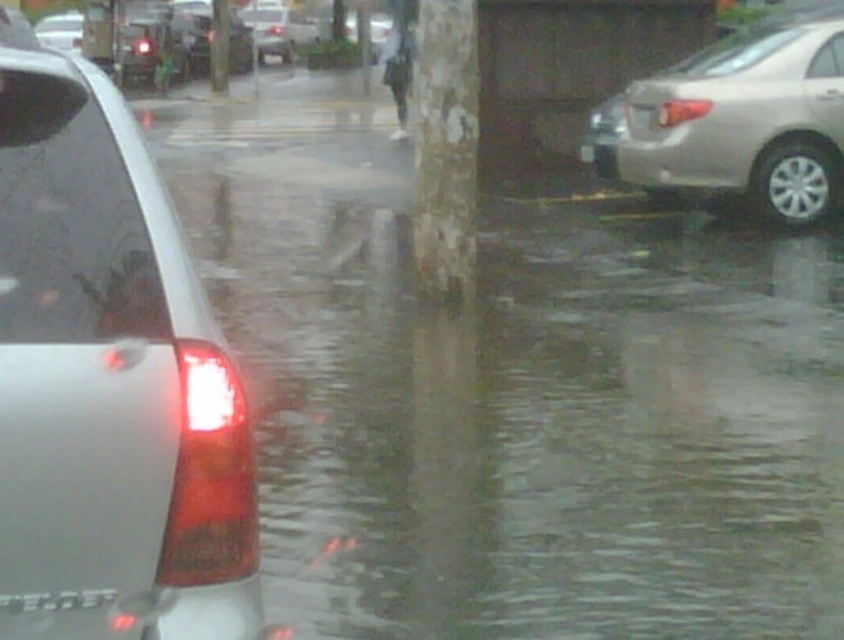
You are standing on the wet street and see the point at coordinates (x=745, y=122). What object is located at that point?

The point at coordinates (x=745, y=122) corresponds to the satin beige sedan at right.

You are a parking attendant trying to fit a new car into the space between the satin beige sedan at right and the matte black car at left. The new car is 1.8 meters wide. Can the new car fit in the space between them?

The satin beige sedan at right is wider than the matte black car at left, so the space between them may vary. However, since the exact width of the space isn not provided, we cannot determine if the new car will fit. Please measure the space physically.

Consider the image. You are standing at the point with coordinates point (109, 381). Looking around, you see the satin silver car at left. Is the car closer to you or farther away compared to the tree trunk in the midground?

The point (109, 381) indicates the satin silver car at left, so the car is closer to you than the tree trunk in the midground.